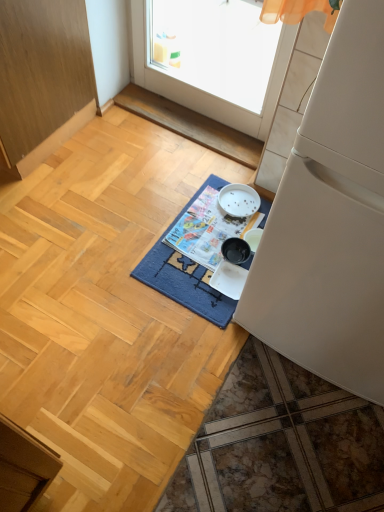
Question: Can you confirm if printed paper magazine at center is positioned to the right of white matte refrigerator at right?

Choices:
 (A) no
 (B) yes

Answer: (A)

Question: Is the position of printed paper magazine at center less distant than that of white matte refrigerator at right?

Choices:
 (A) yes
 (B) no

Answer: (B)

Question: Considering the relative sizes of printed paper magazine at center and white matte refrigerator at right in the image provided, is printed paper magazine at center smaller than white matte refrigerator at right?

Choices:
 (A) no
 (B) yes

Answer: (B)

Question: Considering the relative sizes of printed paper magazine at center and white matte refrigerator at right in the image provided, is printed paper magazine at center shorter than white matte refrigerator at right?

Choices:
 (A) yes
 (B) no

Answer: (A)

Question: Is printed paper magazine at center thinner than white matte refrigerator at right?

Choices:
 (A) no
 (B) yes

Answer: (B)

Question: Is the position of printed paper magazine at center more distant than that of white matte refrigerator at right?

Choices:
 (A) yes
 (B) no

Answer: (A)

Question: Does white matte refrigerator at right have a greater height compared to printed paper magazine at center?

Choices:
 (A) yes
 (B) no

Answer: (A)

Question: Does white matte refrigerator at right appear on the left side of printed paper magazine at center?

Choices:
 (A) yes
 (B) no

Answer: (B)

Question: Is white matte refrigerator at right oriented towards printed paper magazine at center?

Choices:
 (A) yes
 (B) no

Answer: (B)

Question: Can you confirm if white matte refrigerator at right is thinner than printed paper magazine at center?

Choices:
 (A) no
 (B) yes

Answer: (A)

Question: Can you confirm if white matte refrigerator at right is smaller than printed paper magazine at center?

Choices:
 (A) yes
 (B) no

Answer: (B)

Question: Can you confirm if white matte refrigerator at right is positioned to the right of printed paper magazine at center?

Choices:
 (A) yes
 (B) no

Answer: (A)

Question: Is white matte refrigerator at right closer to the viewer compared to wooden cabinet at left?

Choices:
 (A) no
 (B) yes

Answer: (B)